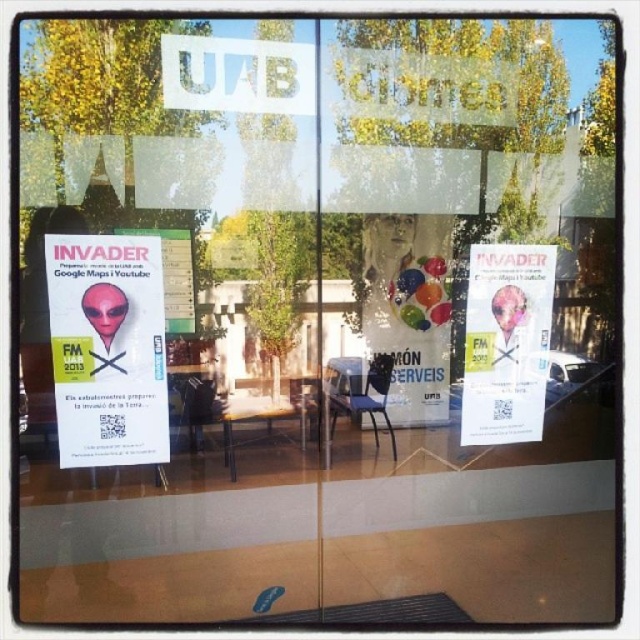
Question: Can you confirm if matte alien head at left is positioned to the right of white paper poster at center?

Choices:
 (A) no
 (B) yes

Answer: (A)

Question: Can you confirm if matte alien head at left is positioned below white paper poster at center?

Choices:
 (A) yes
 (B) no

Answer: (B)

Question: Which point is closer to the camera?

Choices:
 (A) (472, 410)
 (B) (70, 244)

Answer: (B)

Question: Which point is closer to the camera?

Choices:
 (A) (509, 428)
 (B) (65, 387)

Answer: (B)

Question: Does matte alien head at left have a larger size compared to white paper poster at center?

Choices:
 (A) yes
 (B) no

Answer: (B)

Question: Among these objects, which one is nearest to the camera?

Choices:
 (A) white paper poster at center
 (B) matte alien head at left

Answer: (B)